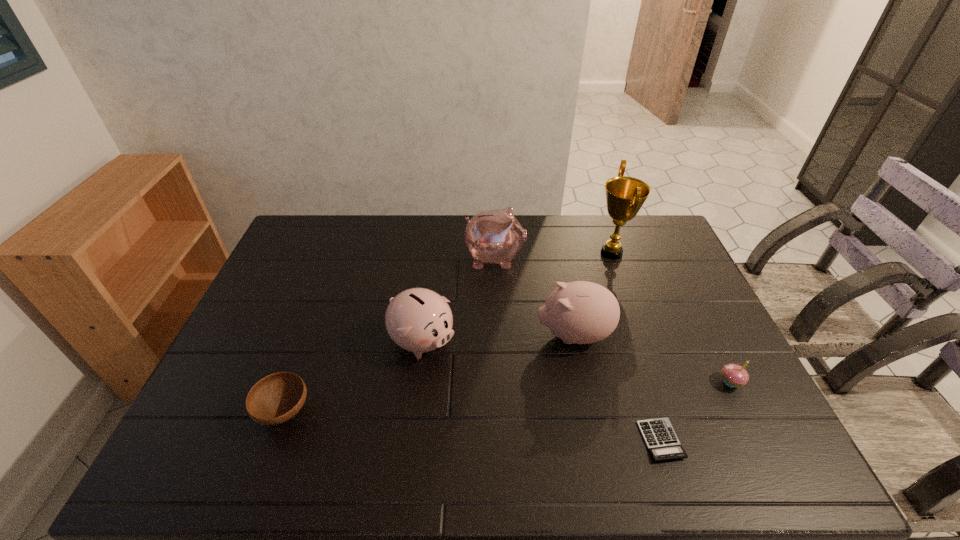
What are the coordinates of `free space located 0.250m on the left of the shortest object` in the screenshot? It's located at (535, 440).

Locate an element on the screen. The width and height of the screenshot is (960, 540). award present at the far edge is located at coordinates (625, 196).

The image size is (960, 540). Find the location of `piggy bank situated at the far edge`. piggy bank situated at the far edge is located at coordinates (495, 236).

Where is `object that is at the near edge`? This screenshot has height=540, width=960. object that is at the near edge is located at coordinates (661, 440).

Where is `object present at the left edge`? This screenshot has height=540, width=960. object present at the left edge is located at coordinates (276, 398).

This screenshot has height=540, width=960. I want to click on object at the right edge, so click(x=734, y=375).

In order to click on vacant space at the far edge in this screenshot , I will do `click(346, 253)`.

The height and width of the screenshot is (540, 960). Find the location of `blank space at the near edge of the desktop`. blank space at the near edge of the desktop is located at coordinates pos(276,463).

Locate an element on the screen. free region at the left edge of the desktop is located at coordinates (267, 325).

This screenshot has height=540, width=960. What are the coordinates of `free space at the right edge of the desktop` in the screenshot? It's located at (645, 282).